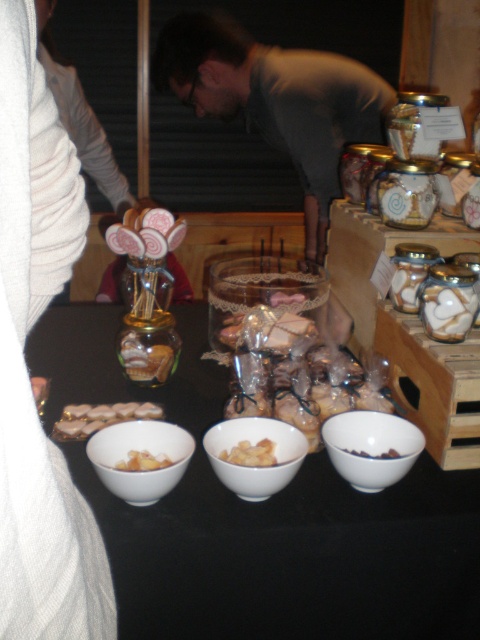
Question: Is white matte bowl at lower center above white matte cookies at center?

Choices:
 (A) no
 (B) yes

Answer: (A)

Question: Is white matte bowl at lower center above white matte cookies at center?

Choices:
 (A) yes
 (B) no

Answer: (B)

Question: Among these points, which one is farthest from the camera?

Choices:
 (A) (56, 420)
 (B) (156, 492)
 (C) (398, 456)

Answer: (A)

Question: Which point is closer to the camera taking this photo?

Choices:
 (A) (41, 522)
 (B) (73, 426)

Answer: (A)

Question: From the image, what is the correct spatial relationship of white glossy bowl at lower right in relation to yellow matte dried fruits at center?

Choices:
 (A) left
 (B) right

Answer: (B)

Question: Which object is positioned closest to the white matte cookies at center?

Choices:
 (A) white glossy nuts at center
 (B) white glossy bowl at lower right
 (C) translucent plastic bag of cookies at center
 (D) brown matte bowl at center

Answer: (C)